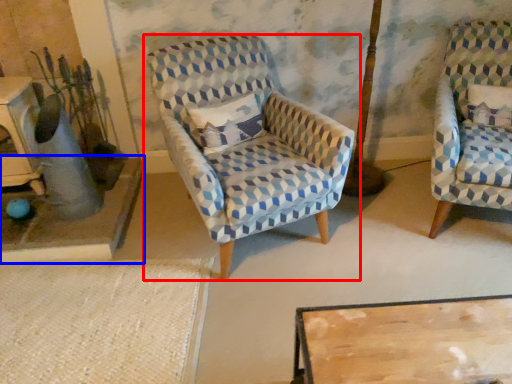
Question: Which point is further to the camera, chair (highlighted by a red box) or table (highlighted by a blue box)?

Choices:
 (A) chair
 (B) table

Answer: (B)